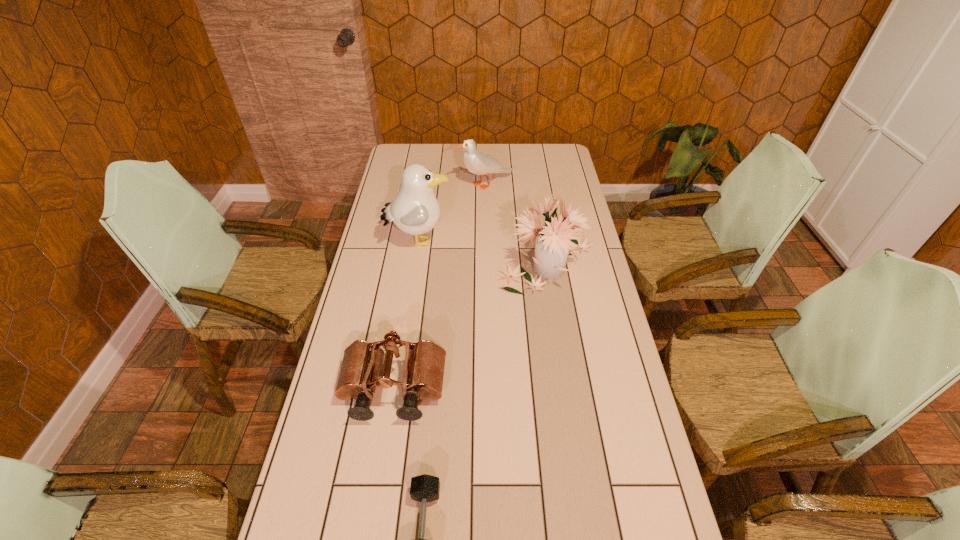
I want to click on vacant space that satisfies the following two spatial constraints: 1. at the beak of the shorter gull; 2. through the eyepieces of the binoculars, so click(490, 389).